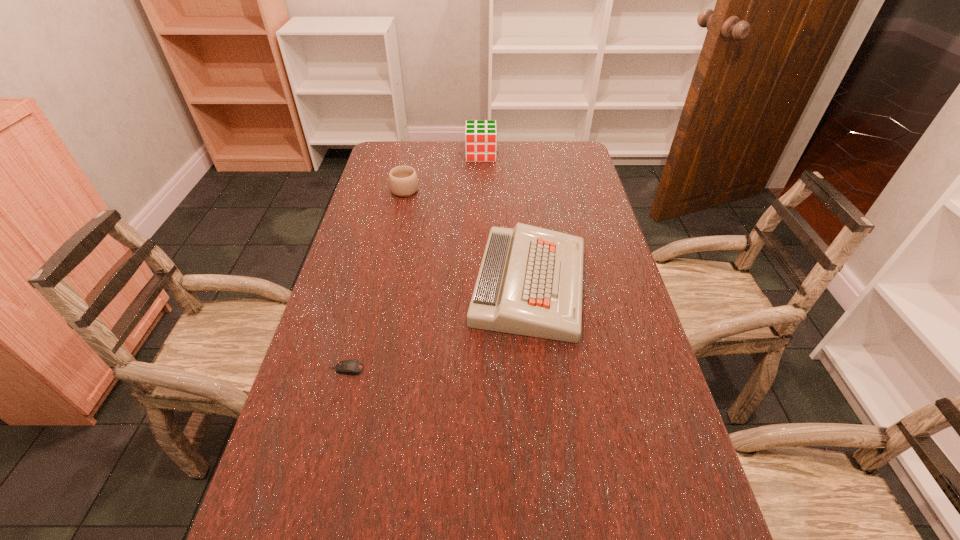
The image size is (960, 540). I want to click on vacant area that lies between the third farthest object and the third nearest object, so click(x=468, y=237).

Identify which object is the third nearest to the shortest object. Please provide its 2D coordinates. Your answer should be formatted as a tuple, i.e. [(x, y)], where the tuple contains the x and y coordinates of a point satisfying the conditions above.

[(480, 135)]

Choose which object is the second nearest neighbor to the computer keyboard. Please provide its 2D coordinates. Your answer should be formatted as a tuple, i.e. [(x, y)], where the tuple contains the x and y coordinates of a point satisfying the conditions above.

[(403, 180)]

The height and width of the screenshot is (540, 960). Find the location of `vacant point that satisfies the following two spatial constraints: 1. on the red face of the computer keyboard; 2. on the right side of the farthest object`. vacant point that satisfies the following two spatial constraints: 1. on the red face of the computer keyboard; 2. on the right side of the farthest object is located at coordinates (481, 284).

Locate an element on the screen. free space in the image that satisfies the following two spatial constraints: 1. on the red face of the tallest object; 2. on the left side of the third farthest object is located at coordinates (481, 284).